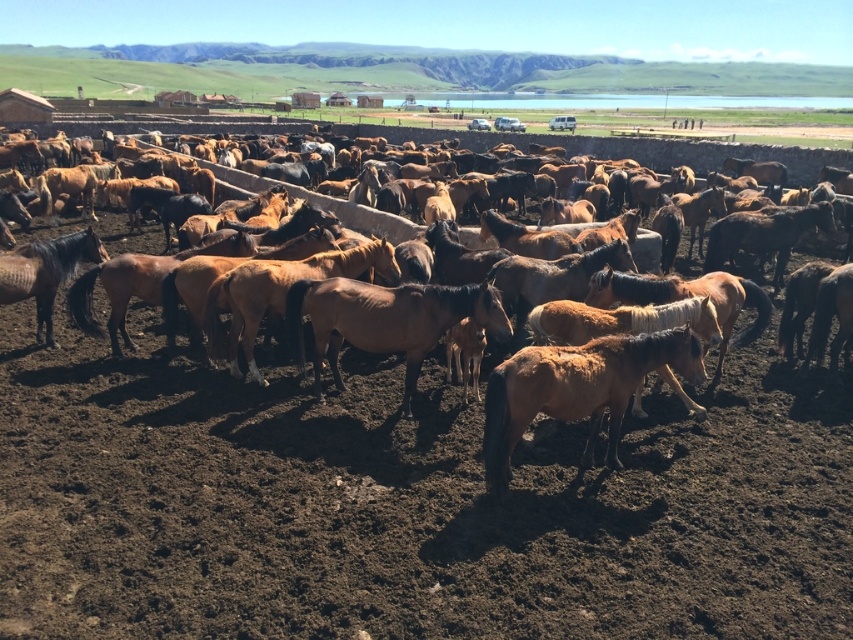
Is brown textured horse at center above brown matte horse at center?

Actually, brown textured horse at center is below brown matte horse at center.

Does point (350, 432) come in front of point (614, 360)?

That is False.

Between point (171, 506) and point (523, 358), which one is positioned in front?

Positioned in front is point (523, 358).

Identify the location of brown textured horse at center. (216, 445).